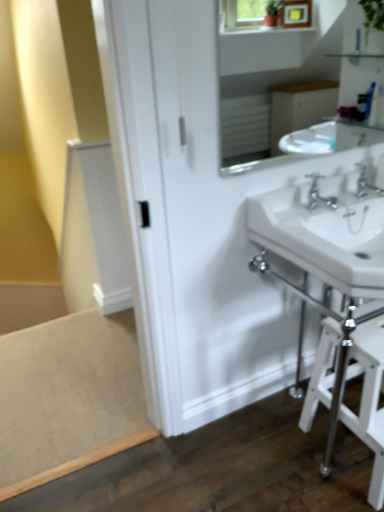
Where is `white glossy table at lower right`? white glossy table at lower right is located at coordinates (339, 346).

This screenshot has width=384, height=512. What are the coordinates of `chrome metallic faucet at upper right, positioned as the first tap in right-to-left order` in the screenshot? It's located at (365, 182).

In order to face chrome metallic faucet at upper right, positioned as the first tap in right-to-left order, should I rotate leftwards or rightwards?

A 22.618 degree turn to the right will do.

The image size is (384, 512). Find the location of `white glossy sink at upper center`. white glossy sink at upper center is located at coordinates (289, 80).

How much space does chrome metallic faucet at center, positioned as the 1th tap in left-to-right order, occupy vertically?

It is 4.80 inches.

At what (x,y) coordinates should I click in order to perform the action: click on white glossy table at lower right. Please return your answer as a coordinate pair (x, y). The width and height of the screenshot is (384, 512). Looking at the image, I should click on (339, 346).

From the image's perspective, is white glossy sink at upper center beneath white glossy table at lower right?

Incorrect, from the image's perspective, white glossy sink at upper center is higher than white glossy table at lower right.

Locate an element on the screen. table on the right of white glossy sink at upper center is located at coordinates point(339,346).

Can you confirm if white glossy sink at upper center is wider than white glossy table at lower right?

No.

Is white glossy table at lower right located within white glossy sink at upper center?

No, white glossy table at lower right is not inside white glossy sink at upper center.

Is white glossy table at lower right wider than chrome metallic faucet at center, positioned as the 2th tap in right-to-left order?

Yes.

Is point (374, 492) closer or farther from the camera than point (312, 199)?

Point (374, 492) is closer to the camera than point (312, 199).

Measure the distance from white glossy table at lower right to chrome metallic faucet at center, positioned as the 1th tap in left-to-right order.

The distance of white glossy table at lower right from chrome metallic faucet at center, positioned as the 1th tap in left-to-right order, is 49.50 centimeters.

Does white glossy table at lower right have a smaller size compared to chrome metallic faucet at center, positioned as the 2th tap in right-to-left order?

No.

Does white ceramic sink at right appear on the right side of chrome metallic faucet at upper right, which ranks as the second tap in left-to-right order?

No, white ceramic sink at right is not to the right of chrome metallic faucet at upper right, which ranks as the second tap in left-to-right order.

From their relative heights in the image, would you say white ceramic sink at right is taller or shorter than chrome metallic faucet at upper right, which ranks as the second tap in left-to-right order?

In the image, white ceramic sink at right appears to be taller than chrome metallic faucet at upper right, which ranks as the second tap in left-to-right order.

Where is `tap that is the 2nd one when counting backward from the white ceramic sink at right`? tap that is the 2nd one when counting backward from the white ceramic sink at right is located at coordinates (365, 182).

Locate an element on the screen. This screenshot has width=384, height=512. sink that is below the chrome metallic faucet at upper right, which ranks as the second tap in left-to-right order (from the image's perspective) is located at coordinates (326, 230).

Is chrome metallic faucet at upper right, which ranks as the second tap in left-to-right order, with white ceramic sink at right?

No, chrome metallic faucet at upper right, which ranks as the second tap in left-to-right order, is not making contact with white ceramic sink at right.

Does chrome metallic faucet at upper right, which ranks as the second tap in left-to-right order, have a lesser height compared to white ceramic sink at right?

Yes.

Is chrome metallic faucet at upper right, which ranks as the second tap in left-to-right order, closer to the viewer compared to white ceramic sink at right?

No, chrome metallic faucet at upper right, which ranks as the second tap in left-to-right order, is behind white ceramic sink at right.

From a real-world perspective, is white glossy table at lower right on top of chrome metallic faucet at upper right, positioned as the first tap in right-to-left order?

No.

In terms of height, does white glossy table at lower right look taller or shorter compared to chrome metallic faucet at upper right, positioned as the first tap in right-to-left order?

Clearly, white glossy table at lower right is taller compared to chrome metallic faucet at upper right, positioned as the first tap in right-to-left order.

The width and height of the screenshot is (384, 512). I want to click on the 2nd tap behind the white glossy table at lower right, starting your count from the anchor, so click(365, 182).

Could you tell me if white glossy table at lower right is turned towards chrome metallic faucet at upper right, positioned as the first tap in right-to-left order?

No, white glossy table at lower right is not oriented towards chrome metallic faucet at upper right, positioned as the first tap in right-to-left order.

Does point (362, 188) appear closer or farther from the camera than point (287, 119)?

Point (362, 188) is closer to the camera than point (287, 119).

Do you think chrome metallic faucet at upper right, which ranks as the second tap in left-to-right order, is within white glossy sink at upper center, or outside of it?

chrome metallic faucet at upper right, which ranks as the second tap in left-to-right order, is spatially situated outside white glossy sink at upper center.

At what (x,y) coordinates should I click in order to perform the action: click on mirror in front of the chrome metallic faucet at upper right, positioned as the first tap in right-to-left order. Please return your answer as a coordinate pair (x, y). Looking at the image, I should click on (289, 80).

Is chrome metallic faucet at upper right, positioned as the first tap in right-to-left order, taller than white glossy sink at upper center?

Incorrect, the height of chrome metallic faucet at upper right, positioned as the first tap in right-to-left order, is not larger of that of white glossy sink at upper center.

Is white glossy sink at upper center beside chrome metallic faucet at center, positioned as the 2th tap in right-to-left order?

No, white glossy sink at upper center is not touching chrome metallic faucet at center, positioned as the 2th tap in right-to-left order.

Considering the relative positions of white glossy sink at upper center and chrome metallic faucet at center, positioned as the 1th tap in left-to-right order, in the image provided, is white glossy sink at upper center behind chrome metallic faucet at center, positioned as the 1th tap in left-to-right order,?

No, white glossy sink at upper center is closer to the camera.

You are a GUI agent. You are given a task and a screenshot of the screen. Output one action in this format:
    pyautogui.click(x=<x>, y=<y>)
    Task: Click on the 2nd tap below when counting from the white glossy sink at upper center (from the image's perspective)
    
    Given the screenshot: What is the action you would take?
    pyautogui.click(x=319, y=194)

Find the location of a particular element. This screenshot has width=384, height=512. mirror that is on the left side of white glossy table at lower right is located at coordinates (289, 80).

This screenshot has width=384, height=512. I want to click on tap that is the 1st one when counting backward from the white glossy table at lower right, so click(x=319, y=194).

Estimate the real-world distances between objects in this image. Which object is further from chrome metallic faucet at upper right, which ranks as the second tap in left-to-right order, chrome metallic faucet at center, positioned as the 1th tap in left-to-right order, or white glossy table at lower right?

white glossy table at lower right is further to chrome metallic faucet at upper right, which ranks as the second tap in left-to-right order.

Which object lies further to the anchor point white ceramic sink at right, chrome metallic faucet at upper right, which ranks as the second tap in left-to-right order, or white glossy table at lower right?

chrome metallic faucet at upper right, which ranks as the second tap in left-to-right order, is further to white ceramic sink at right.

From the image, which object appears to be nearer to white ceramic sink at right, chrome metallic faucet at center, positioned as the 1th tap in left-to-right order, or white glossy sink at upper center?

chrome metallic faucet at center, positioned as the 1th tap in left-to-right order.

From the image, which object appears to be nearer to white glossy table at lower right, white ceramic sink at right or chrome metallic faucet at center, positioned as the 2th tap in right-to-left order?

white ceramic sink at right is closer to white glossy table at lower right.

From the image, which object appears to be nearer to white glossy sink at upper center, white glossy table at lower right or white ceramic sink at right?

white ceramic sink at right lies closer to white glossy sink at upper center than the other object.

When comparing their distances from chrome metallic faucet at upper right, which ranks as the second tap in left-to-right order, does white glossy sink at upper center or white ceramic sink at right seem closer?

Among the two, white ceramic sink at right is located nearer to chrome metallic faucet at upper right, which ranks as the second tap in left-to-right order.

Considering their positions, is chrome metallic faucet at upper right, which ranks as the second tap in left-to-right order, positioned further to white glossy table at lower right than white ceramic sink at right?

The object further to white glossy table at lower right is chrome metallic faucet at upper right, which ranks as the second tap in left-to-right order.

Based on the photo, estimate the real-world distances between objects in this image. Which object is further from chrome metallic faucet at center, positioned as the 1th tap in left-to-right order, white glossy sink at upper center or white glossy table at lower right?

white glossy sink at upper center is further to chrome metallic faucet at center, positioned as the 1th tap in left-to-right order.

Locate an element on the screen. tap between white glossy sink at upper center and chrome metallic faucet at center, positioned as the 2th tap in right-to-left order, from top to bottom is located at coordinates (365, 182).

Locate an element on the screen. tap between chrome metallic faucet at upper right, positioned as the first tap in right-to-left order, and white glossy table at lower right, in the vertical direction is located at coordinates (319, 194).

Locate an element on the screen. tap located between white ceramic sink at right and chrome metallic faucet at upper right, positioned as the first tap in right-to-left order, in the depth direction is located at coordinates (319, 194).

Locate an element on the screen. The image size is (384, 512). sink between white glossy sink at upper center and white glossy table at lower right in the up-down direction is located at coordinates (326, 230).